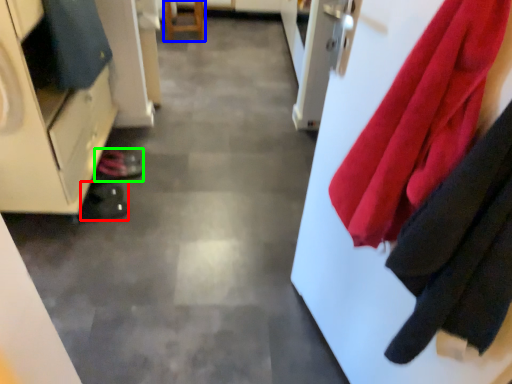
Question: Based on their relative distances, which object is farther from shoe (highlighted by a red box)? Choose from furniture (highlighted by a blue box) and shoe (highlighted by a green box).

Choices:
 (A) furniture
 (B) shoe

Answer: (A)